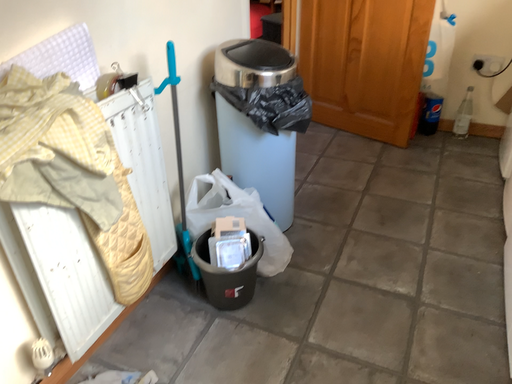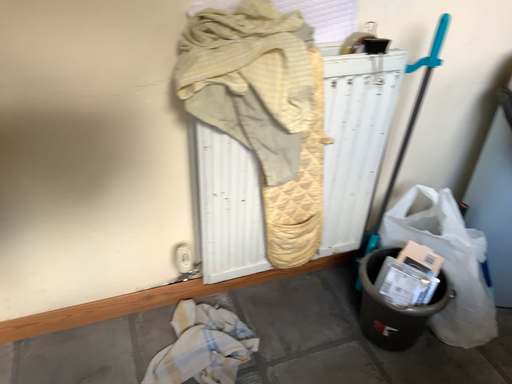
Question: Which way did the camera rotate in the video?

Choices:
 (A) rotated upward
 (B) rotated downward

Answer: (A)